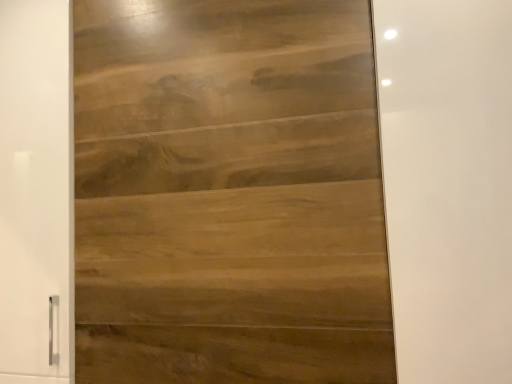
Question: Does wooden panel at left turn towards satin wood door at center?

Choices:
 (A) no
 (B) yes

Answer: (A)

Question: From a real-world perspective, is wooden panel at left positioned under satin wood door at center based on gravity?

Choices:
 (A) yes
 (B) no

Answer: (B)

Question: Is wooden panel at left wider than satin wood door at center?

Choices:
 (A) yes
 (B) no

Answer: (A)

Question: From the image's perspective, is wooden panel at left under satin wood door at center?

Choices:
 (A) yes
 (B) no

Answer: (A)

Question: Does wooden panel at left appear on the right side of satin wood door at center?

Choices:
 (A) yes
 (B) no

Answer: (B)

Question: Is wooden panel at left facing away from satin wood door at center?

Choices:
 (A) no
 (B) yes

Answer: (A)

Question: Is satin wood door at center located outside wooden panel at left?

Choices:
 (A) no
 (B) yes

Answer: (B)

Question: Is satin wood door at center turned away from wooden panel at left?

Choices:
 (A) no
 (B) yes

Answer: (A)

Question: Can you confirm if satin wood door at center is positioned to the right of wooden panel at left?

Choices:
 (A) yes
 (B) no

Answer: (A)

Question: From the image's perspective, is satin wood door at center below wooden panel at left?

Choices:
 (A) no
 (B) yes

Answer: (A)

Question: Is wooden panel at left a part of satin wood door at center?

Choices:
 (A) yes
 (B) no

Answer: (B)

Question: Can you confirm if satin wood door at center is wider than wooden panel at left?

Choices:
 (A) yes
 (B) no

Answer: (B)

Question: Based on their positions, is satin wood door at center located to the left or right of wooden panel at left?

Choices:
 (A) right
 (B) left

Answer: (A)